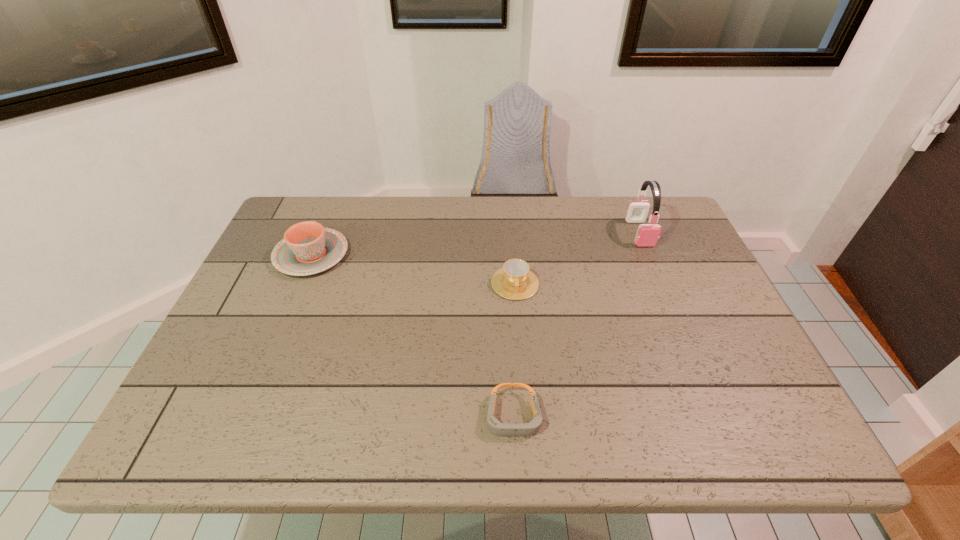
Locate an element on the screen. The height and width of the screenshot is (540, 960). free space between the nearest object and the chinaware is located at coordinates (413, 336).

Identify the location of free space between the third tallest object and the goggles. (515, 350).

Where is `free space between the third tallest object and the leftmost object`? The height and width of the screenshot is (540, 960). free space between the third tallest object and the leftmost object is located at coordinates (414, 269).

The width and height of the screenshot is (960, 540). I want to click on unoccupied area between the earphone and the cup, so click(577, 258).

What are the coordinates of `object that is the second closest one to the second tallest object` in the screenshot? It's located at pos(495,426).

This screenshot has height=540, width=960. In order to click on the second closest object to the third shortest object in this screenshot , I will do `click(495, 426)`.